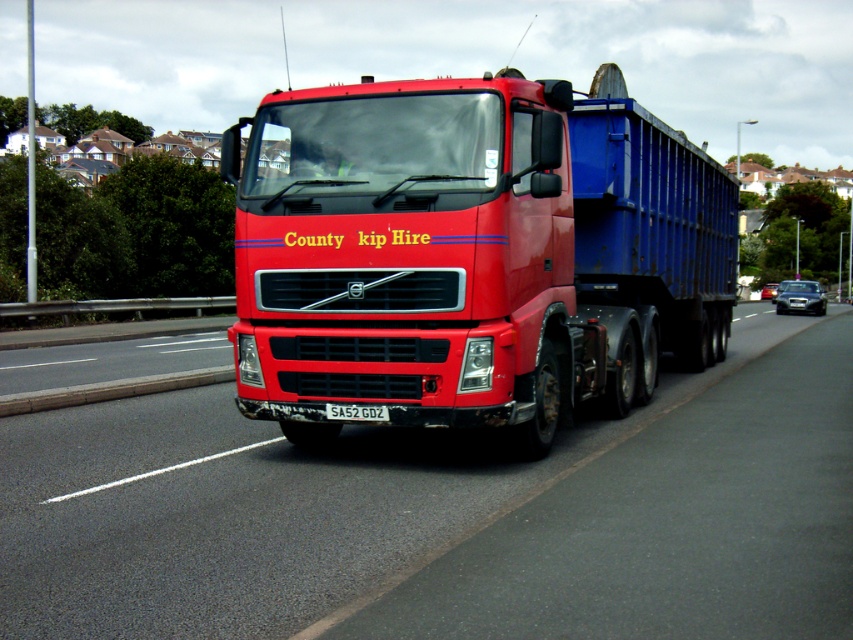
Please describe the location of the point marked at coordinates (450, 515) in the image. What object does this point correspond to?

The point at coordinates (450, 515) corresponds to the metallic asphalt highway at center.

You are a driver planning to overtake the shiny red truck at center on the metallic asphalt highway at center. Considering the size difference between the two, do you think there is enough space to safely maneuver around the truck without crossing the lane dividers?

The metallic asphalt highway at center has a smaller size compared to the shiny red truck at center. This means the truck occupies more of the road space, potentially limiting the available space to overtake safely. It is advisable to wait for a wider section of the highway before attempting to overtake the shiny red truck at center.